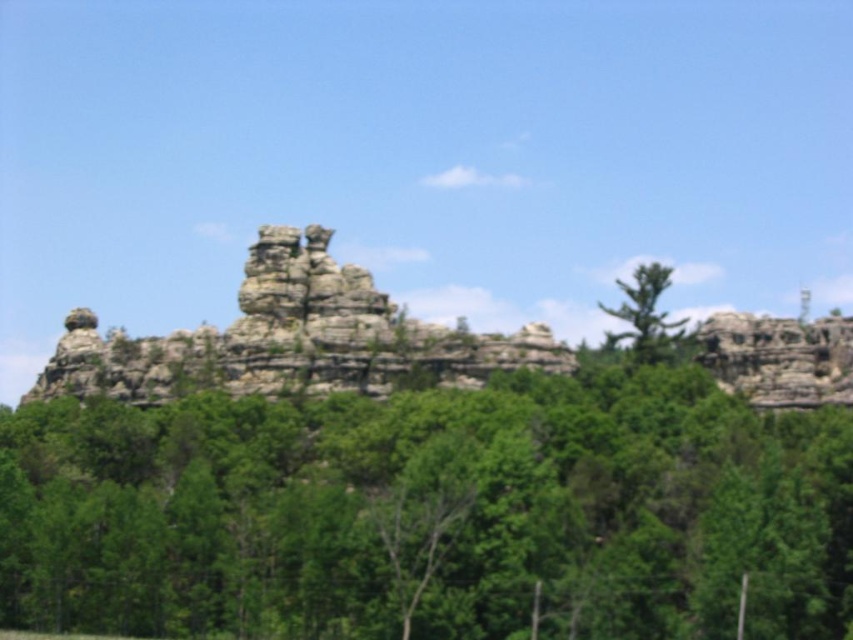
You are a hiker standing in the forest area shown in the image. You want to climb the tallest tree to get a better view of the rock formation. Which tree should you choose between the green leafy tree at center and the green textured tree at upper right?

The green leafy tree at center is much taller than the green textured tree at upper right, so you should choose the green leafy tree at center to climb for the best view.